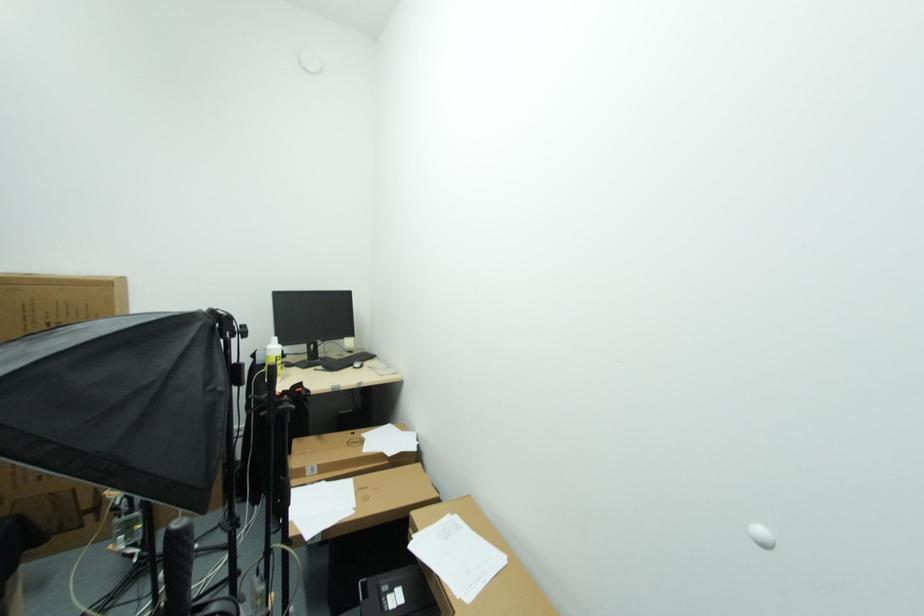
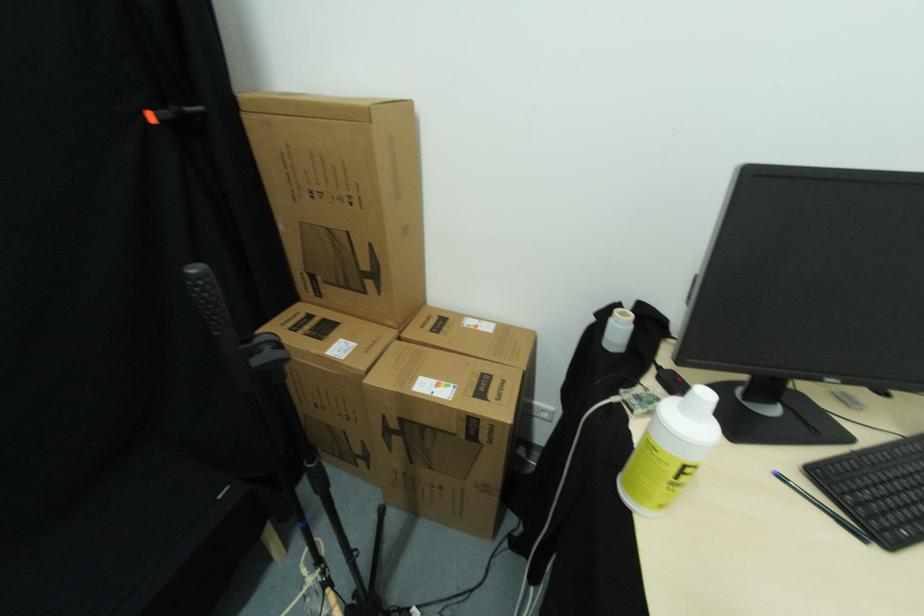
The point at (318, 371) is marked in the first image. Where is the corresponding point in the second image?

(784, 479)